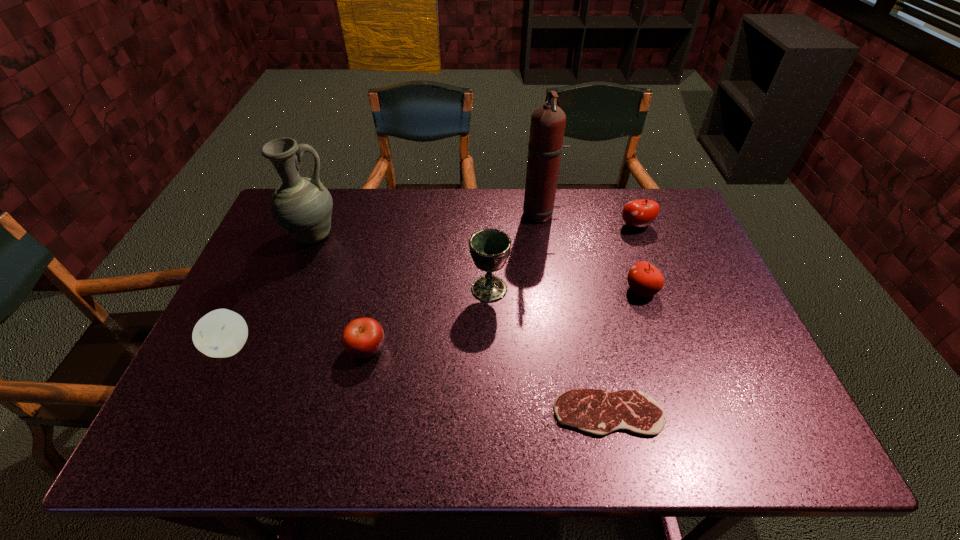
I want to click on free space that satisfies the following two spatial constraints: 1. on the handle side of the seventh shortest object; 2. on the left side of the third object from left to right, so click(x=268, y=348).

The height and width of the screenshot is (540, 960). What are the coordinates of `free region that satisfies the following two spatial constraints: 1. on the handle side of the pitcher; 2. on the back side of the sixth object from right to left` in the screenshot? It's located at (268, 348).